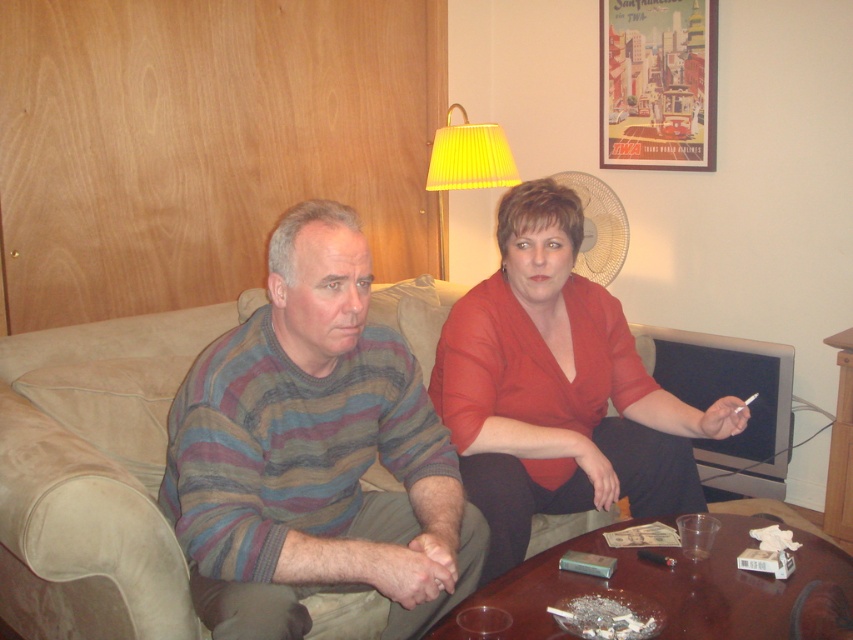
You are a delivery person trying to place a package on the floor between the suede couch at center and the yellow pleated shade at upper center. Can you fit the package there?

The suede couch at center is in front of the yellow pleated shade at upper center, so there is space between them where the package can be placed.

You are designing a new living room layout and want to place a striped sweater at center and a suede couch at center. Given their sizes, which one should you place first to ensure proper spacing?

The suede couch at center is larger than the striped sweater at center, so you should place the suede couch at center first to ensure proper spacing.

You are a delivery person trying to place a package on the floor between the suede couch at center and the yellow pleated shade at upper center. The package is 1 meter long. Can you fit it there without moving either object?

The distance between the suede couch at center and the yellow pleated shade at upper center is 1.25 meters. Since the package is 1 meter long, it will fit with some space to spare.